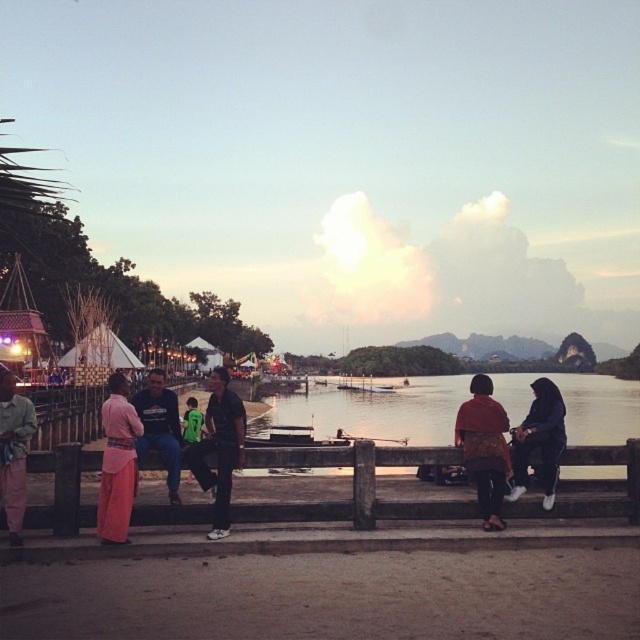
You are standing at the riverside and want to cross the river to reach the opposite bank. The smooth concrete river at center is 9.53 meters from you. If you have a 10 meter long rope, can you safely use it to cross the river?

The smooth concrete river at center is 9.53 meters from the viewer. Since the rope is 10 meters long, it is slightly longer than the distance. Therefore, you can safely use the 10 meter rope to cross the river as it exceeds the required length of 9.53 meters.

You are a photographer trying to capture a photo of the two people wearing the matte green pants at lower left and the green jersey at center. Since you want to include both in the same frame, which one should you position closer to the left side of your camera viewfinder to ensure both are visible?

To include both the matte green pants at lower left and the green jersey at center in the same frame, you should position the green jersey at center closer to the left side of your camera viewfinder because the matte green pants at lower left is already on the right side of the green jersey at center.